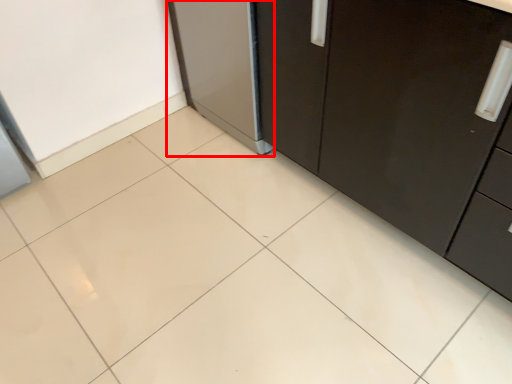
Question: From the image's perspective, where is appliance (annotated by the red box) located relative to cabinetry?

Choices:
 (A) below
 (B) above

Answer: (B)